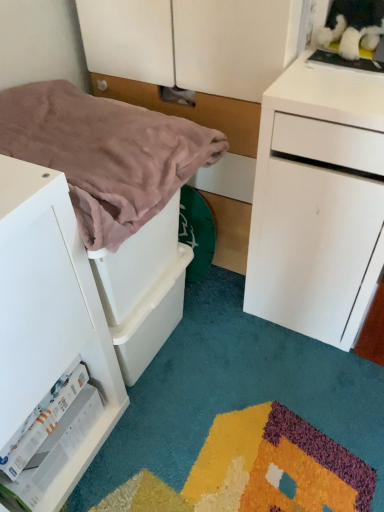
Question: Is white matte drawer at left facing towards matte white dresser at center?

Choices:
 (A) no
 (B) yes

Answer: (A)

Question: From the image's perspective, would you say white matte drawer at left is positioned over matte white dresser at center?

Choices:
 (A) no
 (B) yes

Answer: (A)

Question: Are white matte drawer at left and matte white dresser at center beside each other?

Choices:
 (A) yes
 (B) no

Answer: (B)

Question: From the image's perspective, is white matte drawer at left located beneath matte white dresser at center?

Choices:
 (A) yes
 (B) no

Answer: (A)

Question: Can you confirm if white matte drawer at left is shorter than matte white dresser at center?

Choices:
 (A) no
 (B) yes

Answer: (B)

Question: Visually, is white matte drawer at left positioned to the left or to the right of matte white dresser at center?

Choices:
 (A) left
 (B) right

Answer: (A)

Question: Relative to matte white dresser at center, is white matte drawer at left in front or behind?

Choices:
 (A) behind
 (B) front

Answer: (B)

Question: From the image's perspective, is white matte drawer at left positioned above or below matte white dresser at center?

Choices:
 (A) below
 (B) above

Answer: (A)

Question: Considering the positions of white matte drawer at left and matte white dresser at center in the image, is white matte drawer at left wider or thinner than matte white dresser at center?

Choices:
 (A) thin
 (B) wide

Answer: (A)

Question: In the image, is pink soft blanket at left positioned in front of or behind matte white dresser at center?

Choices:
 (A) front
 (B) behind

Answer: (A)

Question: From the image's perspective, is pink soft blanket at left located above or below matte white dresser at center?

Choices:
 (A) above
 (B) below

Answer: (B)

Question: From a real-world perspective, relative to matte white dresser at center, is pink soft blanket at left vertically above or below?

Choices:
 (A) below
 (B) above

Answer: (B)

Question: Is pink soft blanket at left taller or shorter than matte white dresser at center?

Choices:
 (A) short
 (B) tall

Answer: (A)

Question: Considering the positions of white matte drawer at left and pink soft blanket at left in the image, is white matte drawer at left wider or thinner than pink soft blanket at left?

Choices:
 (A) wide
 (B) thin

Answer: (B)

Question: Which is correct: white matte drawer at left is inside pink soft blanket at left, or outside of it?

Choices:
 (A) inside
 (B) outside

Answer: (B)